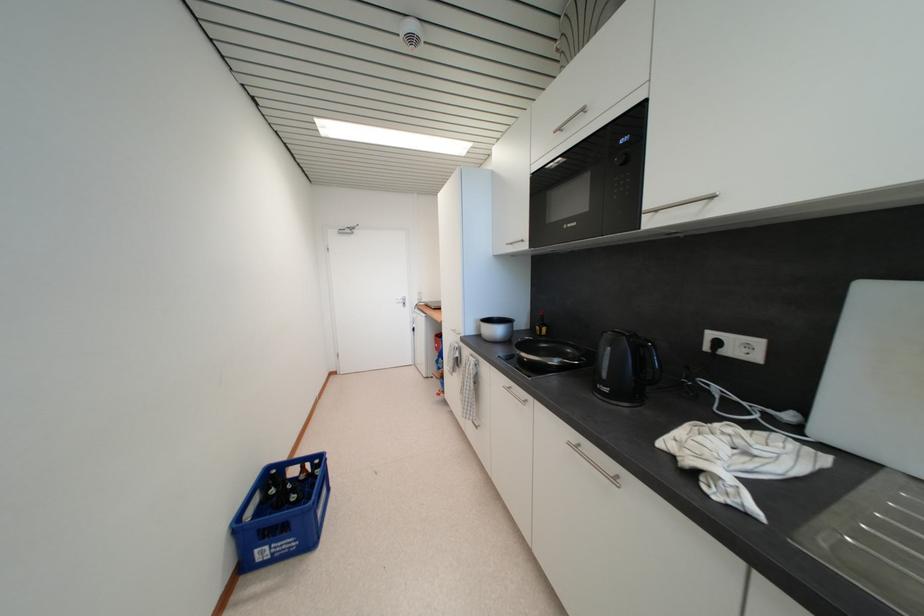
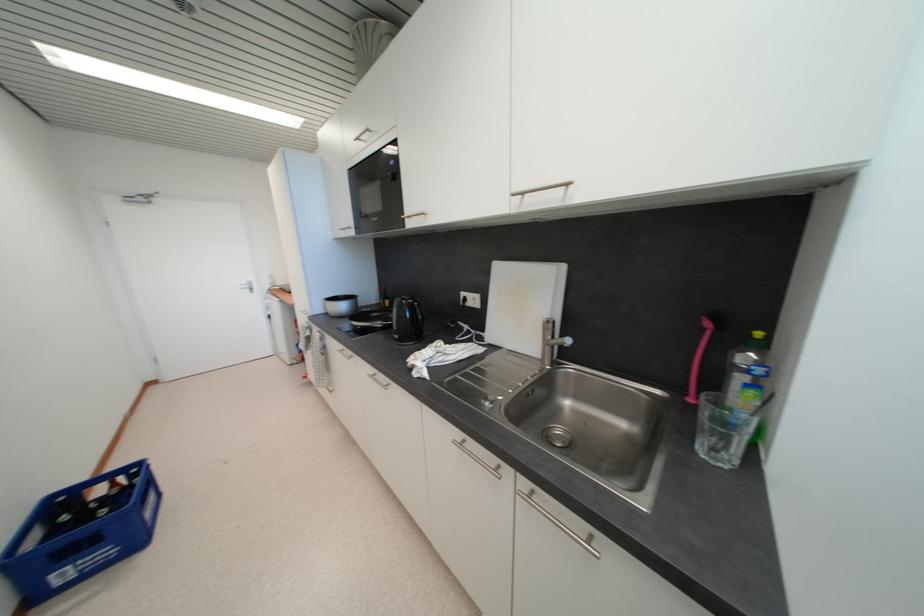
In the second image, find the point that corresponds to the point at 513,385 in the first image.

(346, 349)